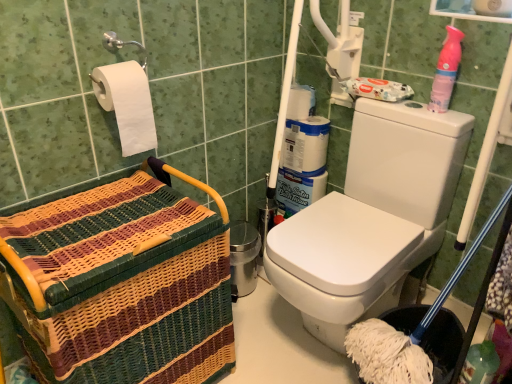
Find the location of `vacant space positioned to the left of pink plastic spray bottle at upper right`. vacant space positioned to the left of pink plastic spray bottle at upper right is located at coordinates (402, 109).